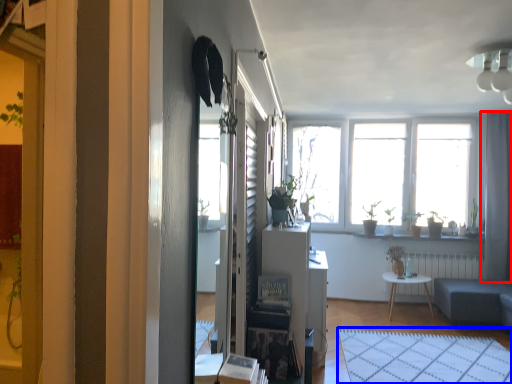
Question: Which object appears farthest to the camera in this image, curtain (highlighted by a red box) or plain (highlighted by a blue box)?

Choices:
 (A) curtain
 (B) plain

Answer: (A)